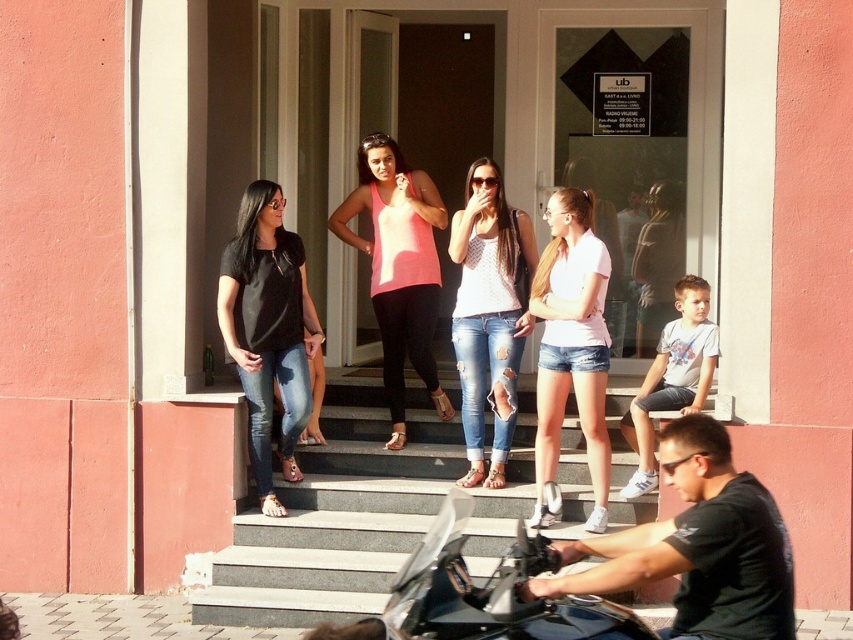
You are standing at the entrance of the building with a pink facade. You notice two points marked on the ground in front of you. The first point is at coordinates point (616, 406) and the second point is at point (708, 493). If you were to walk from the entrance towards these points, which point would you reach first?

Point (708, 493) is reached first because it is in front of point (616, 406), which is located behind it.

You are a photographer standing at the entrance of the building. You want to take a photo that includes both the black matte jeans at lower left and the pink fabric tank top at center. Which object should you focus on first to ensure both are in sharp focus?

You should focus on the black matte jeans at lower left first because it is closer to the viewer than the pink fabric tank top at center. By focusing on the closer object, the depth of field may still keep the farther object in acceptable focus.